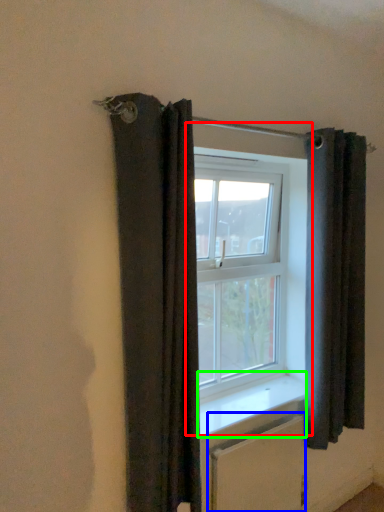
Question: Based on their relative distances, which object is farther from window (highlighted by a red box)? Choose from radiator (highlighted by a blue box) and window sill (highlighted by a green box).

Choices:
 (A) radiator
 (B) window sill

Answer: (A)